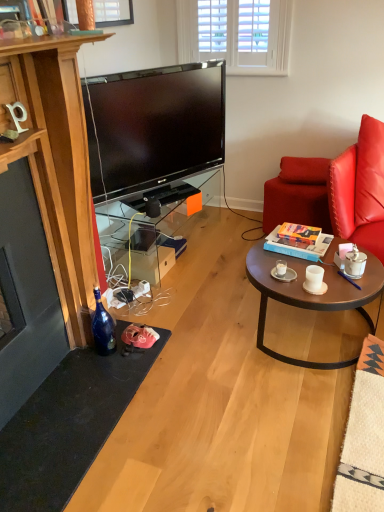
The image size is (384, 512). What are the coordinates of `vacant area that is in front of white ceramic coffee cup at right, the third coffee cup positioned from the left` in the screenshot? It's located at (360, 289).